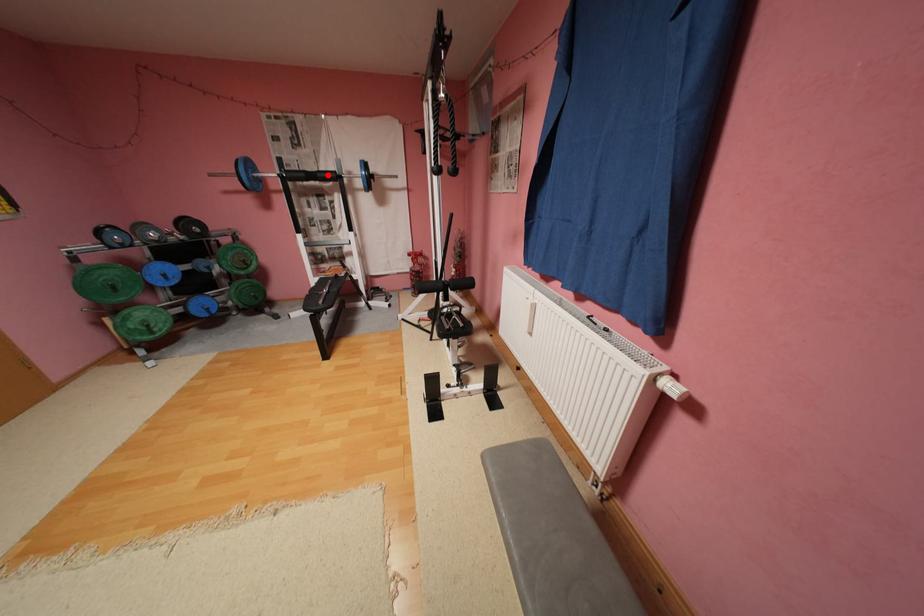
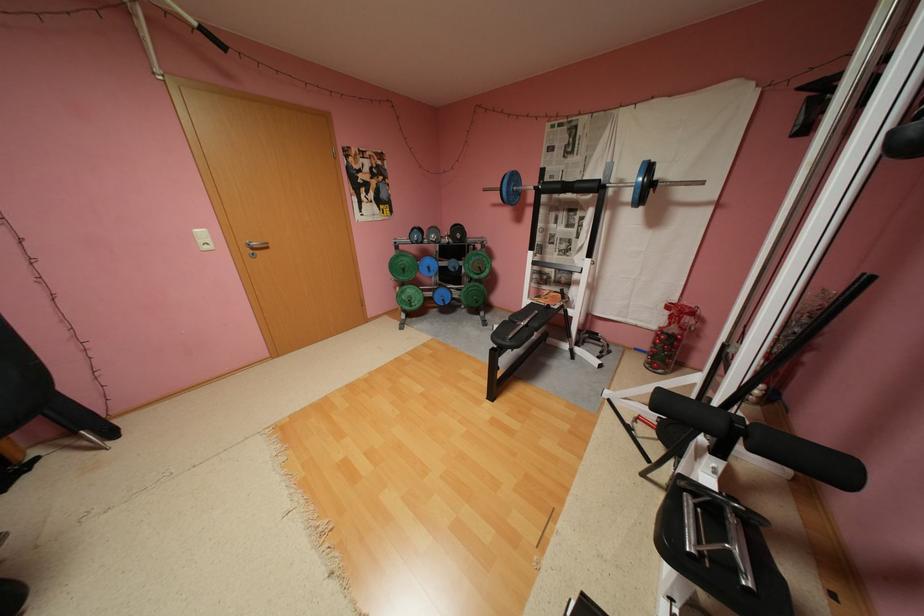
The point at the highlighted location is marked in the first image. Where is the corresponding point in the second image?

(586, 185)